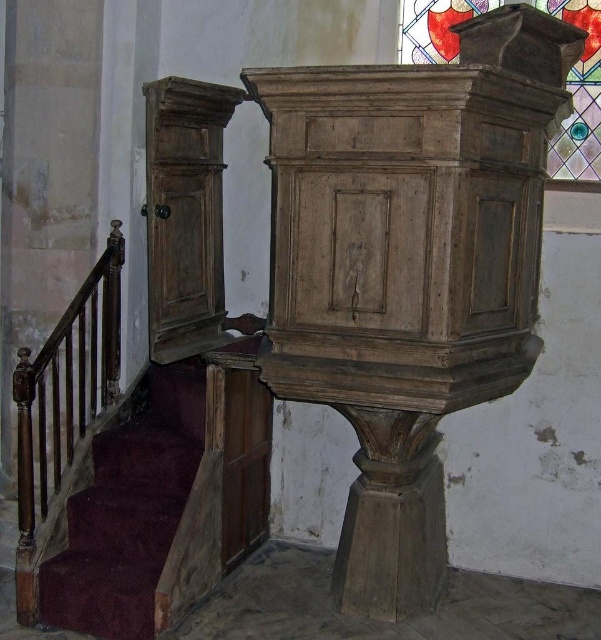
Question: Is velvet burgundy stairs at lower left further to the viewer compared to stained glass at upper right?

Choices:
 (A) no
 (B) yes

Answer: (A)

Question: From the image, what is the correct spatial relationship of velvet burgundy stairs at lower left in relation to stained glass at upper right?

Choices:
 (A) left
 (B) right

Answer: (A)

Question: Is velvet burgundy stairs at lower left positioned behind stained glass at upper right?

Choices:
 (A) yes
 (B) no

Answer: (B)